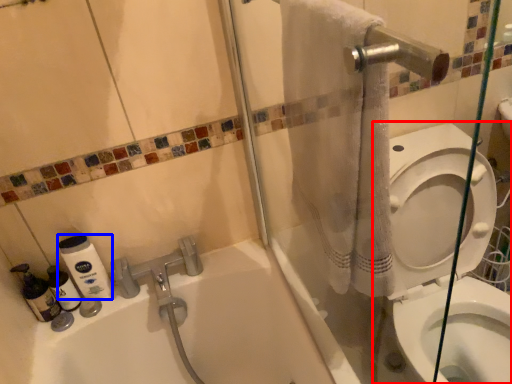
Question: Which object appears farthest to the camera in this image, toilet (highlighted by a red box) or cleaning product (highlighted by a blue box)?

Choices:
 (A) toilet
 (B) cleaning product

Answer: (B)